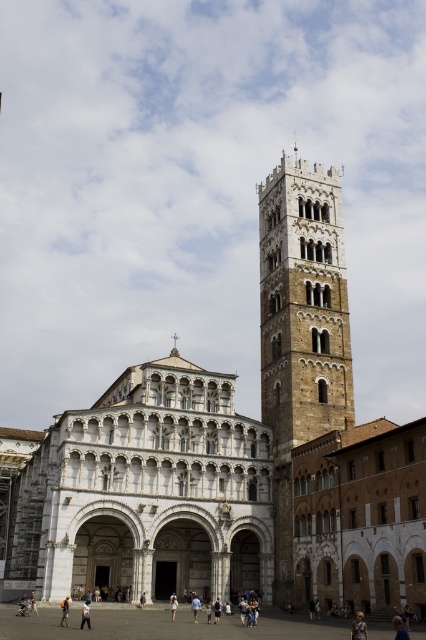
Question: Which of the following is the closest to the observer?

Choices:
 (A) (362, 625)
 (B) (400, 618)
 (C) (275, 193)
 (D) (169, 602)

Answer: (A)

Question: Does dark brown leather jacket at lower right have a greater width compared to light brown leather jacket at lower center?

Choices:
 (A) yes
 (B) no

Answer: (B)

Question: Can you confirm if white stone cathedral at center is positioned to the left of light brown leather bag at center?

Choices:
 (A) no
 (B) yes

Answer: (B)

Question: Which of the following is the closest to the observer?

Choices:
 (A) (271, 573)
 (B) (175, 604)
 (C) (25, 608)
 (D) (356, 625)

Answer: (D)

Question: Can you confirm if dark brown leather jacket at lower right is positioned to the right of camouflage fabric person at center?

Choices:
 (A) no
 (B) yes

Answer: (B)

Question: Which object is positioned farthest from the light brown leather jacket at lower center?

Choices:
 (A) light brown leather bag at center
 (B) light brown leather jacket at lower left
 (C) dark brown leather jacket at lower right
 (D) white stone cathedral at center

Answer: (C)